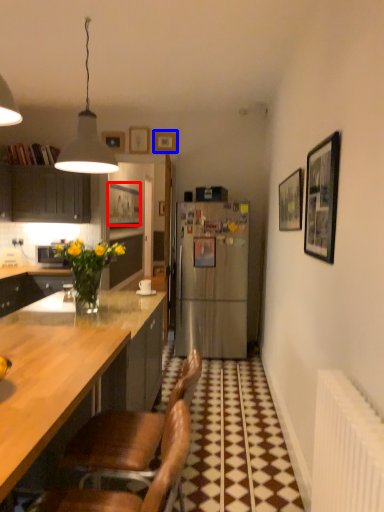
Question: Which object is further to the camera taking this photo, picture frame (highlighted by a red box) or picture frame (highlighted by a blue box)?

Choices:
 (A) picture frame
 (B) picture frame

Answer: (A)